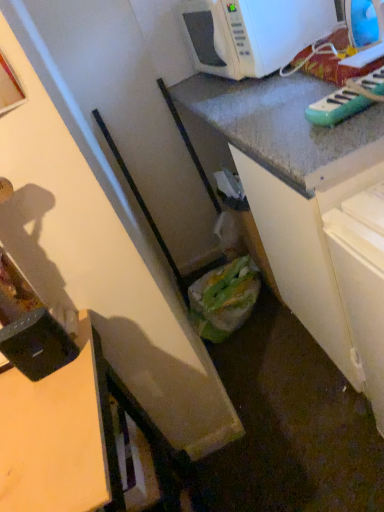
Identify the location of vacant space in front of black plastic container at lower left, which appears as the second appliance when viewed from the top. (50, 419).